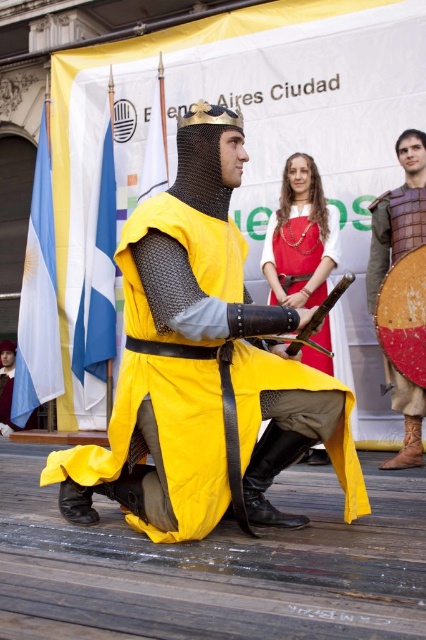
Does point (207, 403) come behind point (325, 346)?

No.

Where is `matte gold chainmail helmet at center`? The height and width of the screenshot is (640, 426). matte gold chainmail helmet at center is located at coordinates (201, 365).

Is point (149, 492) farther from viewer compared to point (422, 160)?

No, (149, 492) is in front of (422, 160).

Is point (132, 440) less distant than point (411, 412)?

Yes, point (132, 440) is closer to viewer.

Is point (170, 400) closer to viewer compared to point (388, 220)?

Yes, it is.

You are a GUI agent. You are given a task and a screenshot of the screen. Output one action in this format:
    pyautogui.click(x=<x>, y=<y>)
    Task: Click on the matte gold chainmail helmet at center
    Image resolution: width=426 pixels, height=640 pixels.
    Given the screenshot: What is the action you would take?
    pyautogui.click(x=201, y=365)

Is matte gold chainmail helmet at center shorter than wooden shield at center?

No.

Which is in front, point (178, 356) or point (399, 280)?

Point (178, 356) is more forward.

Locate an element on the screen. This screenshot has height=640, width=426. matte gold chainmail helmet at center is located at coordinates (x=201, y=365).

This screenshot has height=640, width=426. I want to click on matte gold chainmail helmet at center, so click(x=201, y=365).